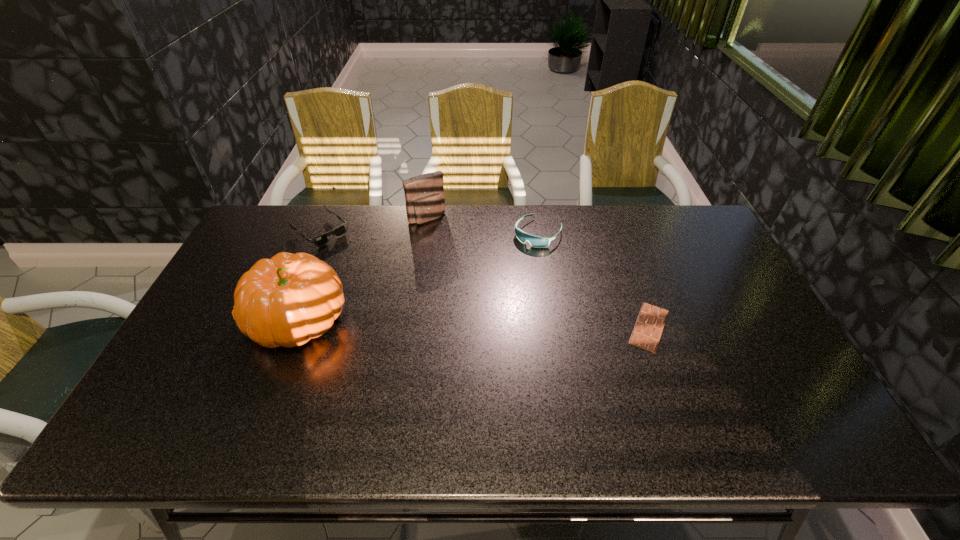
This screenshot has width=960, height=540. What are the coordinates of `vacant space in between the rightmost object and the pumpkin` in the screenshot? It's located at (473, 323).

I want to click on free space between the pumpkin and the third shortest object, so coord(419,276).

This screenshot has height=540, width=960. I want to click on blank region between the chocolate bar and the fourth tallest object, so pos(485,279).

The height and width of the screenshot is (540, 960). What are the coordinates of `object that is the closest one to the fourth object from left to right` in the screenshot? It's located at (424, 194).

Where is `object that is the fourth closest one to the second shortest object`? The width and height of the screenshot is (960, 540). object that is the fourth closest one to the second shortest object is located at coordinates [x=648, y=328].

Locate an element on the screen. This screenshot has width=960, height=540. free location that satisfies the following two spatial constraints: 1. on the front side of the pouch; 2. on the left side of the goggles is located at coordinates (424, 233).

The height and width of the screenshot is (540, 960). I want to click on vacant space that satisfies the following two spatial constraints: 1. on the front side of the sunglasses; 2. on the right side of the rightmost object, so click(x=280, y=327).

In order to click on vacant space that satisfies the following two spatial constraints: 1. on the back side of the second shortest object; 2. on the right side of the fourth shortest object in this screenshot , I will do `click(325, 218)`.